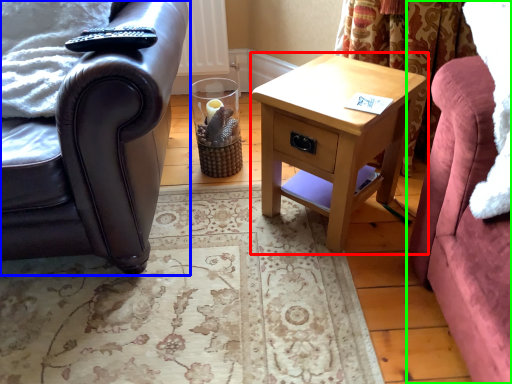
Question: Which object is the farthest from nightstand (highlighted by a red box)? Choose among these: chair (highlighted by a blue box) or studio couch (highlighted by a green box).

Choices:
 (A) chair
 (B) studio couch

Answer: (A)